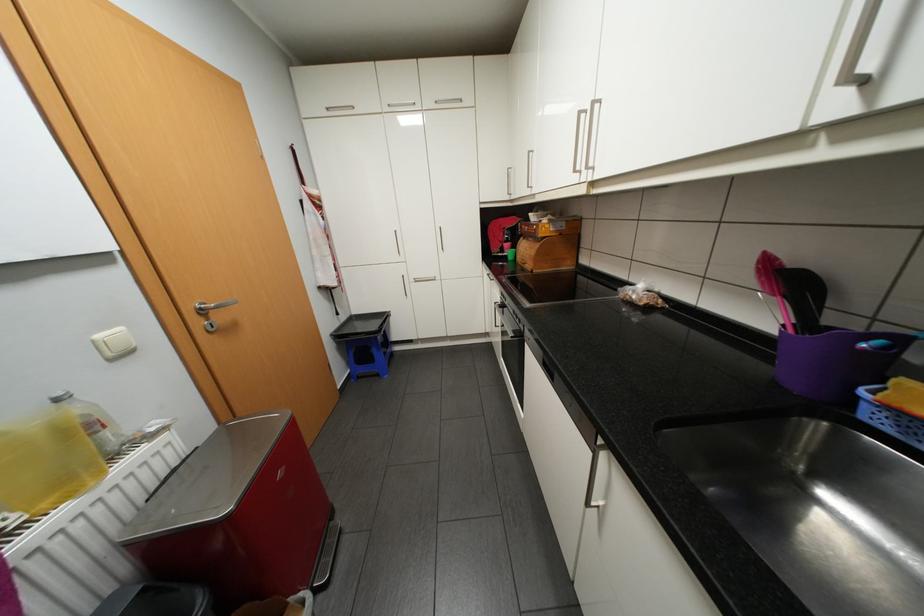
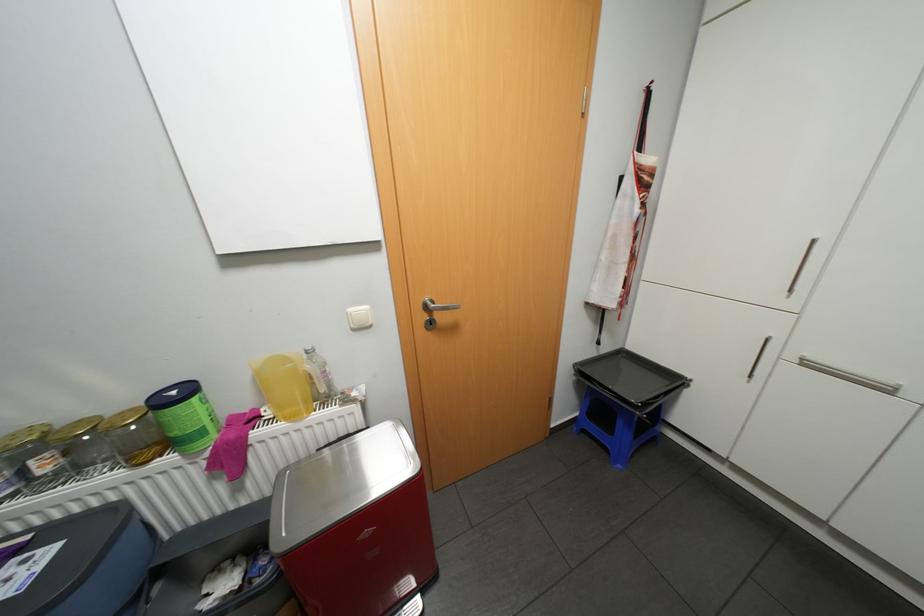
First-person continuous shooting, in which direction is the camera rotating?

The camera's rotation is toward left-down.